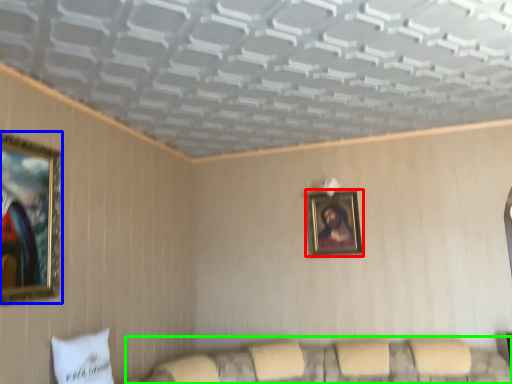
Question: Which is farther away from picture frame (highlighted by a red box)? picture frame (highlighted by a blue box) or couch (highlighted by a green box)?

Choices:
 (A) picture frame
 (B) couch

Answer: (A)